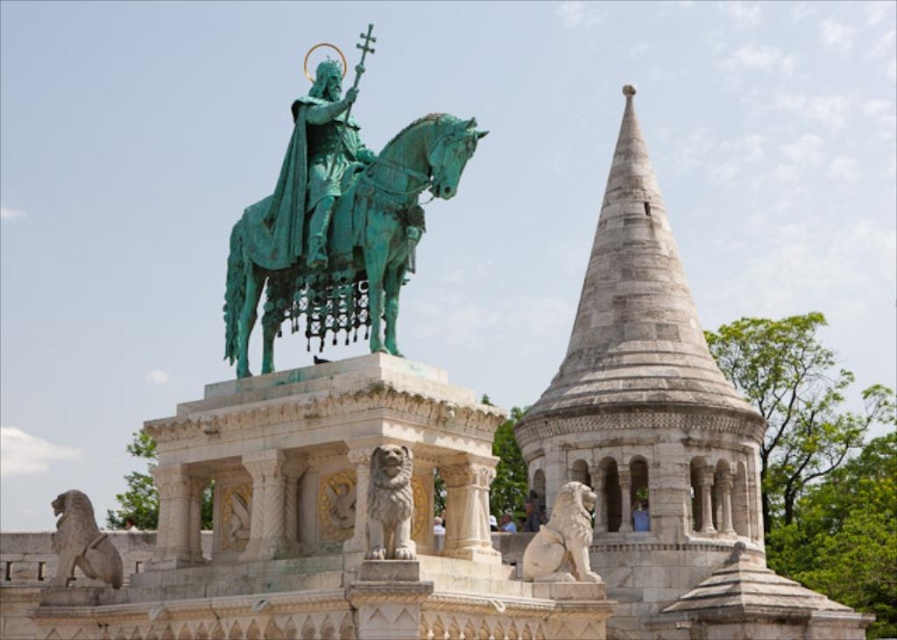
Question: Among these objects, which one is farthest from the camera?

Choices:
 (A) green patina statue at center
 (B) green patina horse at center
 (C) white marble lion at lower right

Answer: (A)

Question: Is green patina statue at center positioned before light brown leather cap at upper center?

Choices:
 (A) no
 (B) yes

Answer: (B)

Question: Is white marble lion at lower right below light brown leather cap at upper center?

Choices:
 (A) yes
 (B) no

Answer: (B)

Question: Among these points, which one is farthest from the camera?

Choices:
 (A) (747, 545)
 (B) (575, 564)
 (C) (527, 500)
 (D) (58, 518)

Answer: (C)

Question: Which object is the farthest from the white stone tower at center right?

Choices:
 (A) light brown wooden chair at center
 (B) green patina statue at center
 (C) light brown leather cap at upper center
 (D) green patina horse at center

Answer: (B)

Question: From the image, what is the correct spatial relationship of green patina statue at center in relation to white marble lion at lower right?

Choices:
 (A) above
 (B) below

Answer: (A)